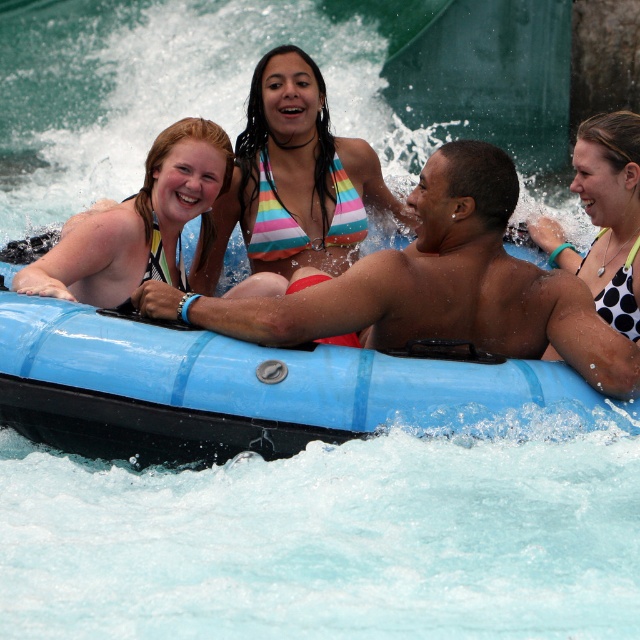
Who is more distant from viewer, (x=314, y=154) or (x=598, y=116)?

The point (x=314, y=154) is more distant.

Measure the distance from rainbow striped bikini top at center to white dotted swimsuit at right.

The distance of rainbow striped bikini top at center from white dotted swimsuit at right is 18.29 feet.

What do you see at coordinates (294, 179) in the screenshot?
I see `rainbow striped bikini top at center` at bounding box center [294, 179].

The height and width of the screenshot is (640, 640). I want to click on rainbow striped bikini top at center, so click(294, 179).

From the picture: Is matte black swimsuit at left to the left of white dotted swimsuit at right from the viewer's perspective?

Indeed, matte black swimsuit at left is positioned on the left side of white dotted swimsuit at right.

Is matte black swimsuit at left shorter than white dotted swimsuit at right?

No, matte black swimsuit at left is not shorter than white dotted swimsuit at right.

Find the location of a particular element. This screenshot has width=640, height=640. matte black swimsuit at left is located at coordinates [x=140, y=221].

Who is lower down, blue rubber raft at center or rainbow striped bikini top at center?

blue rubber raft at center is below.

What do you see at coordinates (253, 390) in the screenshot? The width and height of the screenshot is (640, 640). I see `blue rubber raft at center` at bounding box center [253, 390].

Which is in front, point (86, 413) or point (227, 212)?

Positioned in front is point (86, 413).

Find the location of a particular element. The width and height of the screenshot is (640, 640). blue rubber raft at center is located at coordinates (253, 390).